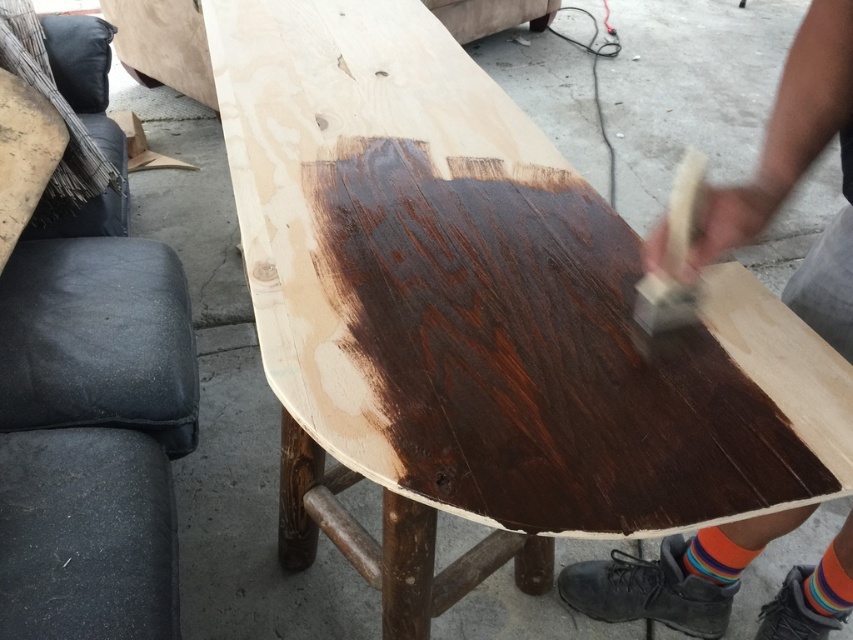
You are organizing a small workshop and need to place a tool box between the black leather stool at lower left and the wooden textured hammer at right. Based on their positions, where should you place the toolbox to ensure it is between them?

The black leather stool at lower left is below the wooden textured hammer at right, so to place the toolbox between them, position it in the middle area between the lower left and the right side, ensuring it is above the stool and below the hammer.

You are a painter who needs to sit down to rest. You see the black leather stool at lower left and the wooden textured hammer at right. Which object is taller and can you sit on?

The black leather stool at lower left is much taller than the wooden textured hammer at right, so you can sit on the black leather stool at lower left.